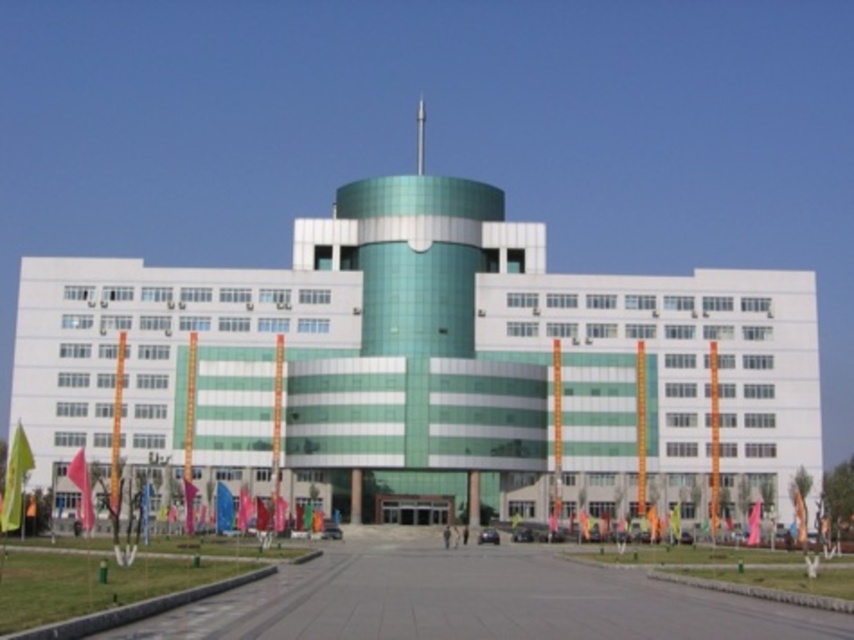
You are standing in front of the building and want to take a photo. There are two points marked on the ground in front of you at coordinates point (15, 513) and point (86, 525). Which point is closer to your current position?

Point (15, 513) is closer to the camera than point (86, 525), so it is closer to your current position.

You are standing in front of the building and notice the red fabric flag at lower left and the green fabric flag at center. Which flag is positioned higher in the scene?

The red fabric flag at lower left is located above the green fabric flag at center, so it is positioned higher.